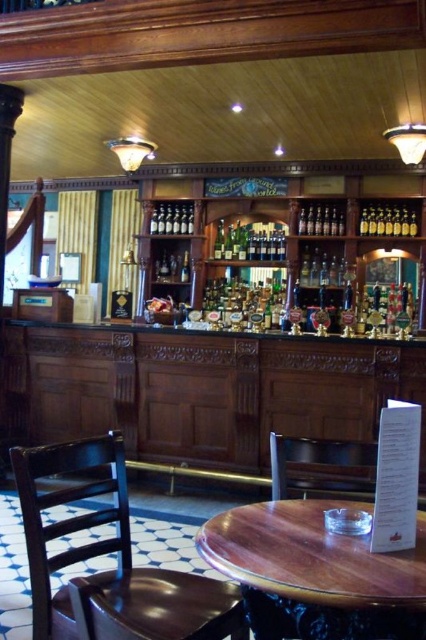
Is point (290, 593) positioned in front of point (261, 240)?

Yes, it is in front of point (261, 240).

Who is more distant from viewer, (299, 573) or (281, 227)?

The point (281, 227) is more distant.

Find the location of a particular element. This screenshot has height=640, width=426. wooden round table at center is located at coordinates (316, 573).

Can you confirm if shiny gold bottles at upper right is thinner than shiny silver bottles at center?

In fact, shiny gold bottles at upper right might be wider than shiny silver bottles at center.

Looking at this image, does shiny gold bottles at upper right lie behind shiny silver bottles at center?

No, shiny gold bottles at upper right is closer to the viewer.

Is point (405, 224) behind point (154, 208)?

No, it is in front of (154, 208).

Identify the location of shiny gold bottles at upper right. [388, 221].

Between dark brown wooden chair at lower left and wooden round table at center, which one is positioned higher?

dark brown wooden chair at lower left

Does dark brown wooden chair at lower left have a lesser width compared to wooden round table at center?

No, dark brown wooden chair at lower left is not thinner than wooden round table at center.

Describe the element at coordinates (118, 561) in the screenshot. The height and width of the screenshot is (640, 426). I see `dark brown wooden chair at lower left` at that location.

Identify the location of dark brown wooden chair at lower left. (118, 561).